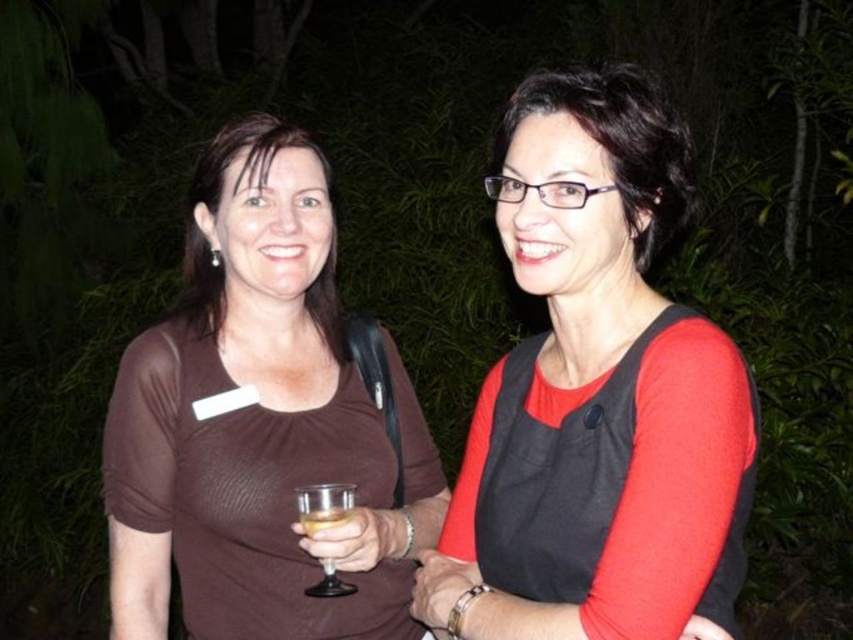
Is red matte dress at center shorter than matte black glasses at upper center?

No, red matte dress at center is not shorter than matte black glasses at upper center.

Does red matte dress at center lie behind matte black glasses at upper center?

No.

The height and width of the screenshot is (640, 853). Identify the location of red matte dress at center. (596, 396).

Does matte brown blouse at left come behind clear glass wine glass at center?

Yes, matte brown blouse at left is further from the viewer.

Consider the image. Can you confirm if matte brown blouse at left is smaller than clear glass wine glass at center?

Incorrect, matte brown blouse at left is not smaller in size than clear glass wine glass at center.

Between point (189, 259) and point (323, 516), which one is positioned in front?

Point (323, 516) is more forward.

Locate an element on the screen. The width and height of the screenshot is (853, 640). matte brown blouse at left is located at coordinates (218, 211).

Find the location of a particular element. matte black glasses at upper center is located at coordinates point(619,144).

Is point (618, 90) more distant than point (181, 301)?

No, (618, 90) is closer to viewer.

Find the location of a particular element. This screenshot has width=853, height=640. matte black glasses at upper center is located at coordinates tap(619, 144).

Identify the location of matte black glasses at upper center. (619, 144).